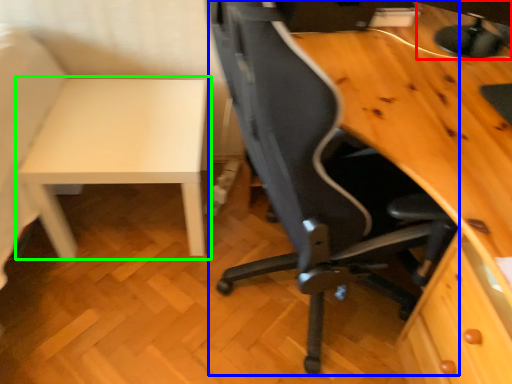
Question: Which object is the closest to the computer monitor (highlighted by a red box)? Choose among these: chair (highlighted by a blue box) or table (highlighted by a green box).

Choices:
 (A) chair
 (B) table

Answer: (A)